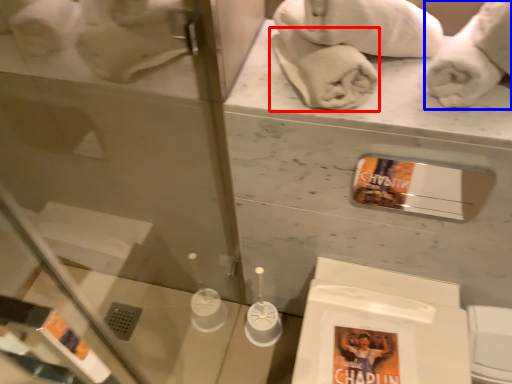
Question: Which of the following is the farthest to the observer, bath towel (highlighted by a red box) or bath towel (highlighted by a blue box)?

Choices:
 (A) bath towel
 (B) bath towel

Answer: (A)